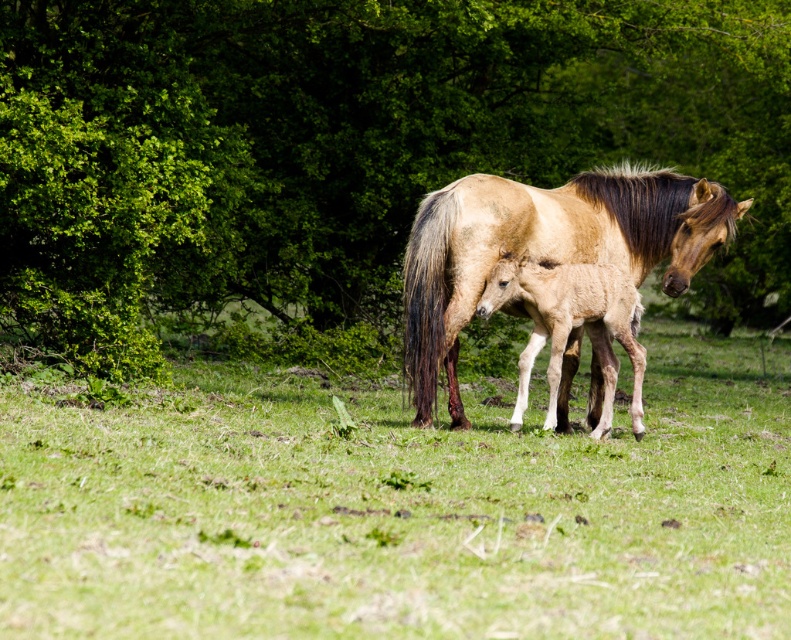
Does green leafy tree at center have a smaller size compared to light brown glossy horse at center?

No, green leafy tree at center is not smaller than light brown glossy horse at center.

Does point (517, 125) come behind point (583, 250)?

Yes, point (517, 125) is behind point (583, 250).

Identify the location of green leafy tree at center. (347, 145).

Can you confirm if green grassy at center is positioned above light brown glossy horse at center?

Incorrect, green grassy at center is not positioned above light brown glossy horse at center.

Describe the element at coordinates (400, 509) in the screenshot. I see `green grassy at center` at that location.

Between point (769, 529) and point (543, 208), which one is positioned behind?

Point (543, 208)

This screenshot has width=791, height=640. Identify the location of green grassy at center. 400,509.

From the picture: Which is more to the left, green leafy tree at center or green grassy at center?

green grassy at center

Is point (225, 168) farther from viewer compared to point (38, 636)?

Yes.

Where is `green leafy tree at center`? The image size is (791, 640). green leafy tree at center is located at coordinates (347, 145).